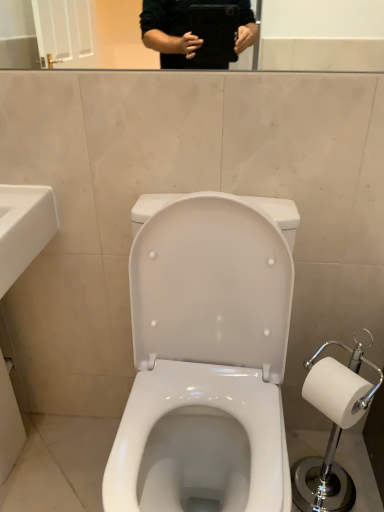
Question: Does white glossy toilet at center have a smaller size compared to white ceramic sink at lower left?

Choices:
 (A) no
 (B) yes

Answer: (A)

Question: Is white glossy toilet at center positioned in front of white ceramic sink at lower left?

Choices:
 (A) yes
 (B) no

Answer: (A)

Question: Can you confirm if white glossy toilet at center is shorter than white ceramic sink at lower left?

Choices:
 (A) no
 (B) yes

Answer: (B)

Question: Can white ceramic sink at lower left be found inside white glossy toilet at center?

Choices:
 (A) no
 (B) yes

Answer: (A)

Question: From the image's perspective, does white glossy toilet at center appear lower than white ceramic sink at lower left?

Choices:
 (A) yes
 (B) no

Answer: (A)

Question: From the image's perspective, is white glossy toilet at center on white ceramic sink at lower left?

Choices:
 (A) yes
 (B) no

Answer: (B)

Question: Does white plastic toilet paper holder at right appear on the left side of white glossy toilet at center?

Choices:
 (A) yes
 (B) no

Answer: (B)

Question: Is white plastic toilet paper holder at right turned away from white glossy toilet at center?

Choices:
 (A) no
 (B) yes

Answer: (A)

Question: Is white plastic toilet paper holder at right surrounding white glossy toilet at center?

Choices:
 (A) yes
 (B) no

Answer: (B)

Question: Considering the relative sizes of white plastic toilet paper holder at right and white glossy toilet at center in the image provided, is white plastic toilet paper holder at right shorter than white glossy toilet at center?

Choices:
 (A) no
 (B) yes

Answer: (B)

Question: Is the position of white plastic toilet paper holder at right more distant than that of white glossy toilet at center?

Choices:
 (A) no
 (B) yes

Answer: (B)

Question: Is white plastic toilet paper holder at right oriented towards white glossy toilet at center?

Choices:
 (A) yes
 (B) no

Answer: (A)

Question: Does white ceramic sink at lower left come in front of white glossy toilet at center?

Choices:
 (A) yes
 (B) no

Answer: (B)